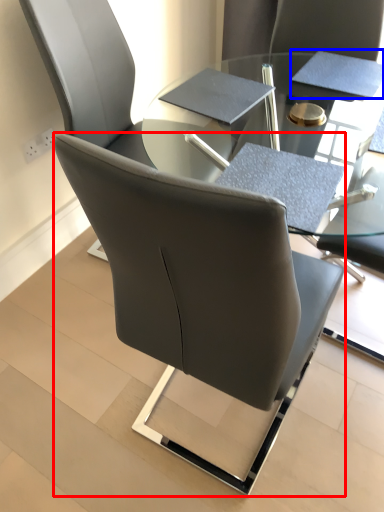
Question: Which point is further to the camera, chair (highlighted by a red box) or notepad (highlighted by a blue box)?

Choices:
 (A) chair
 (B) notepad

Answer: (B)